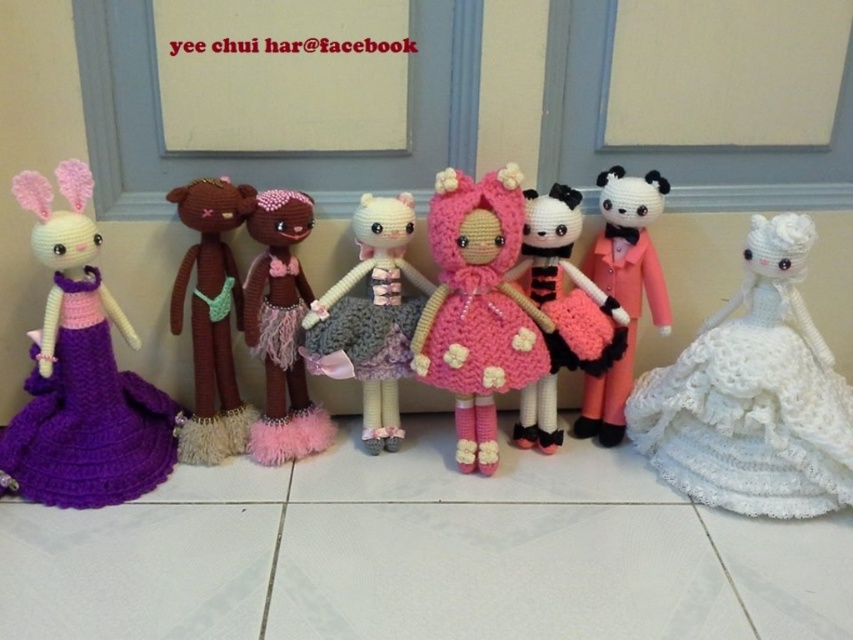
You are standing in front of the crocheted dolls displayed against the light wall. You notice two points marked on the image at coordinates point (753, 509) and point (234, 387). Which point is closer to you?

Point (753, 509) is in front of point (234, 387), so it is closer to you.

You are an artist trying to replicate the arrangement of the crocheted dolls. According to the image, where is the pink crocheted dress at center positioned in relation to the other dolls?

The pink crocheted dress at center is located at point coordinates (x=477, y=307), which places it centrally in the arrangement among the other dolls.

Looking at the line of crocheted dolls against the light wall, which doll is shorter between the brown yarn doll at center and the panda doll at center?

The brown yarn doll at center is shorter than the panda doll at center.